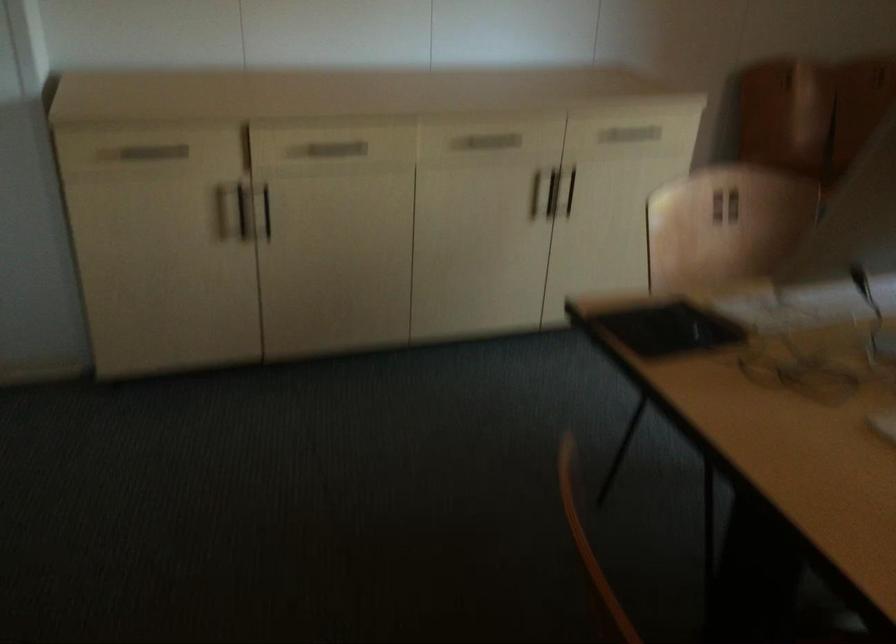
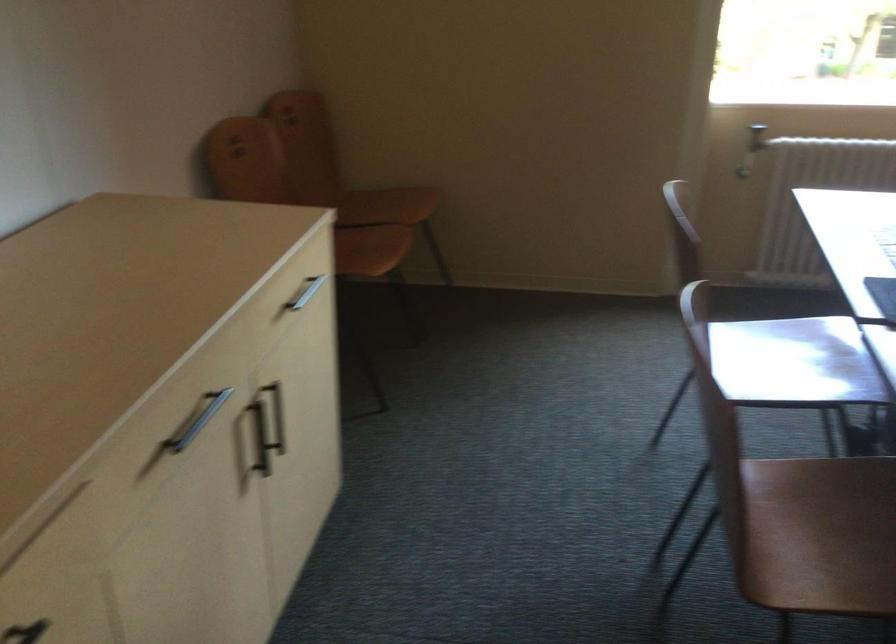
Find the pixel in the second image that matches the point at 556,194 in the first image.

(260, 438)